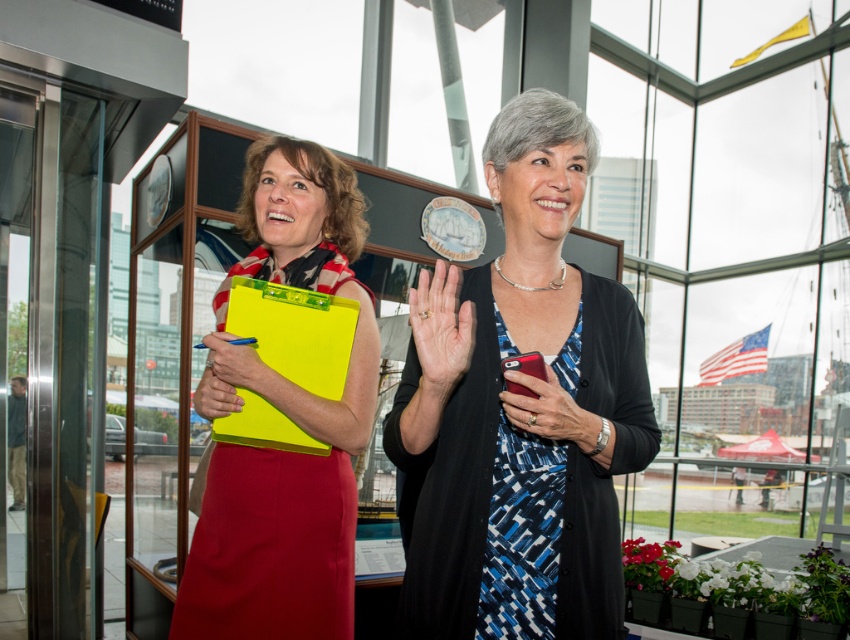
Question: Is blue printed dress at center to the left of matte yellow clipboard at center from the viewer's perspective?

Choices:
 (A) yes
 (B) no

Answer: (B)

Question: Among these points, which one is farthest from the camera?

Choices:
 (A) (350, 525)
 (B) (581, 520)

Answer: (A)

Question: Can you confirm if blue printed dress at center is positioned above matte yellow clipboard at center?

Choices:
 (A) no
 (B) yes

Answer: (B)

Question: Can you confirm if blue printed dress at center is positioned to the left of matte yellow clipboard at center?

Choices:
 (A) yes
 (B) no

Answer: (B)